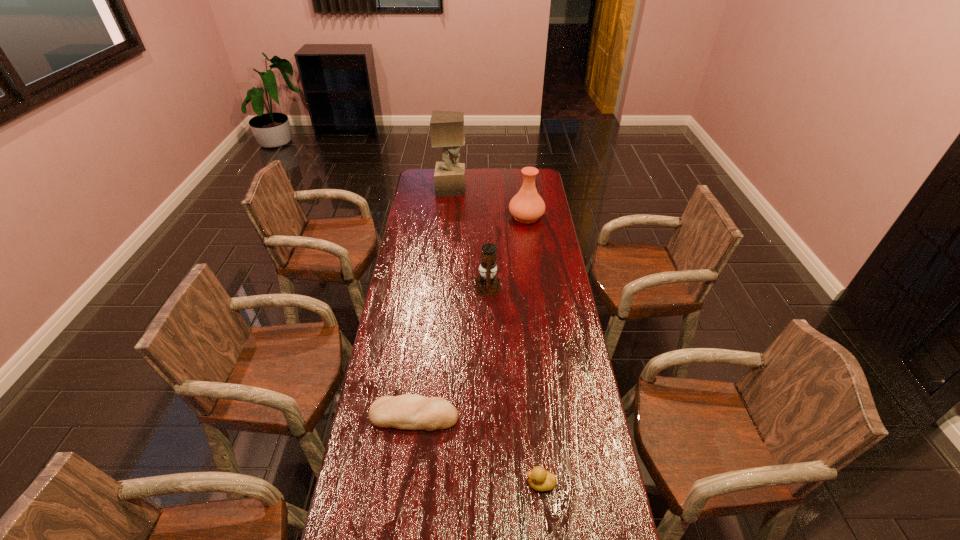
Locate an element on the screen. empty space that is in between the nearest object and the lantern is located at coordinates (514, 386).

Identify the location of free space between the third object from left to right and the vase. (507, 252).

Locate an element on the screen. The height and width of the screenshot is (540, 960). free space between the second farthest object and the lantern is located at coordinates (507, 252).

Locate an element on the screen. The width and height of the screenshot is (960, 540). free area in between the second nearest object and the fourth nearest object is located at coordinates (470, 316).

Identify the location of free spot between the tallest object and the second nearest object. (433, 302).

The width and height of the screenshot is (960, 540). Find the location of `vacant point located between the tallest object and the bread`. vacant point located between the tallest object and the bread is located at coordinates (433, 302).

This screenshot has width=960, height=540. In order to click on empty space between the fourth tallest object and the second nearest object in this screenshot , I will do `click(477, 450)`.

Locate which object is the closest to the nearest object. Please provide its 2D coordinates. Your answer should be formatted as a tuple, i.e. [(x, y)], where the tuple contains the x and y coordinates of a point satisfying the conditions above.

[(408, 411)]

Locate which object ranks in proximity to the third object from left to right. Please provide its 2D coordinates. Your answer should be formatted as a tuple, i.e. [(x, y)], where the tuple contains the x and y coordinates of a point satisfying the conditions above.

[(526, 206)]

Locate an element on the screen. Image resolution: width=960 pixels, height=540 pixels. vacant space that satisfies the following two spatial constraints: 1. on the front side of the fourth nearest object; 2. on the side of the third nearest object, there is a wick adjustment knob is located at coordinates (536, 287).